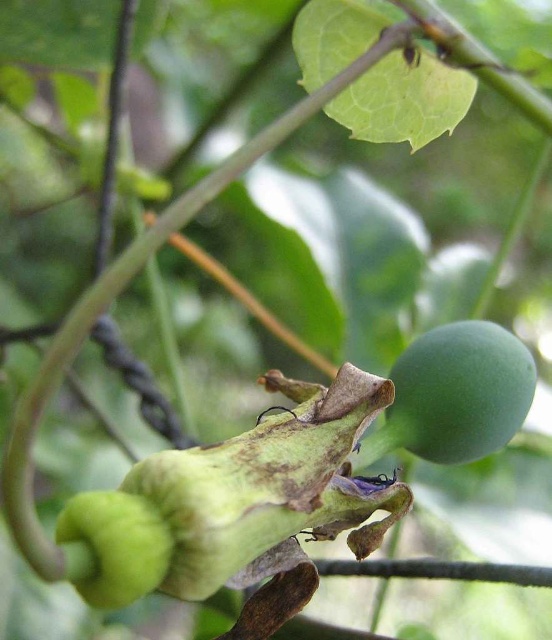
You are an artist sketching this scene. You need to draw the green matte fruit at upper right and the green matte fruit at lower left. Which one should you draw first if you want to start with the one that is positioned more to the right?

The green matte fruit at upper right is positioned more to the right compared to the green matte fruit at lower left, so you should draw the green matte fruit at upper right first.

You are an agricultural inspector checking the growth of passionfruit. You notice two green matte fruit at upper right and green matte fruit at lower left. Which one is bigger?

The green matte fruit at upper right is larger in size than the green matte fruit at lower left.